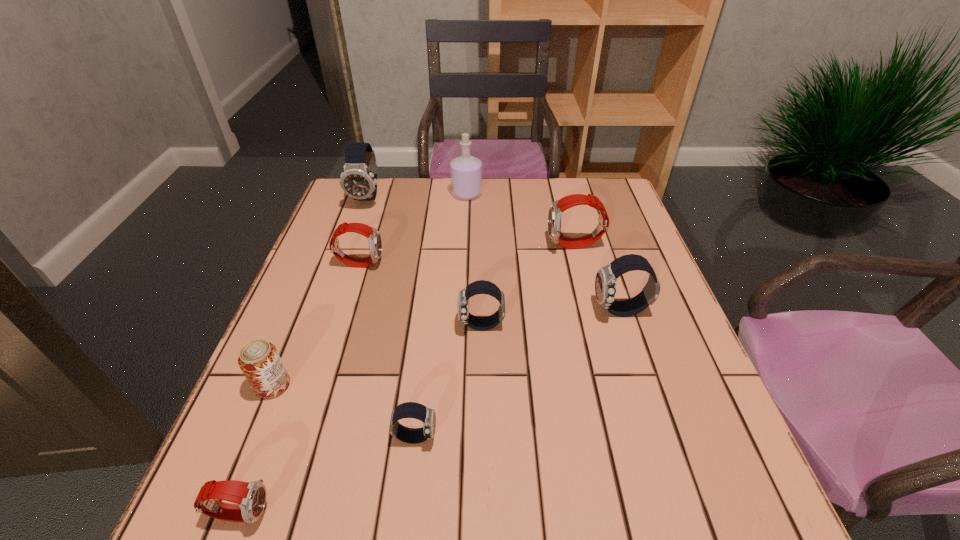
Identify the location of dark watch that is the closest to the perfume. This screenshot has height=540, width=960. (358, 180).

At what (x,y) coordinates should I click in order to perform the action: click on dark watch that is the third closest to the purple perfume. Please return your answer as a coordinate pair (x, y). Looking at the image, I should click on click(605, 282).

Locate which red watch ranks third in proximity to the rightmost dark watch. Please provide its 2D coordinates. Your answer should be formatted as a tuple, i.e. [(x, y)], where the tuple contains the x and y coordinates of a point satisfying the conditions above.

[(250, 497)]

Where is `red watch identified as the closest to the seventh farthest object`? red watch identified as the closest to the seventh farthest object is located at coordinates (250, 497).

Identify the location of free space that satisfies the following two spatial constraints: 1. on the face of the rightmost dark watch; 2. on the front side of the third nearest object. (644, 386).

Find the location of a particular element. vacant region that satisfies the following two spatial constraints: 1. on the face of the farthest watch; 2. on the face of the nearest watch is located at coordinates click(x=257, y=512).